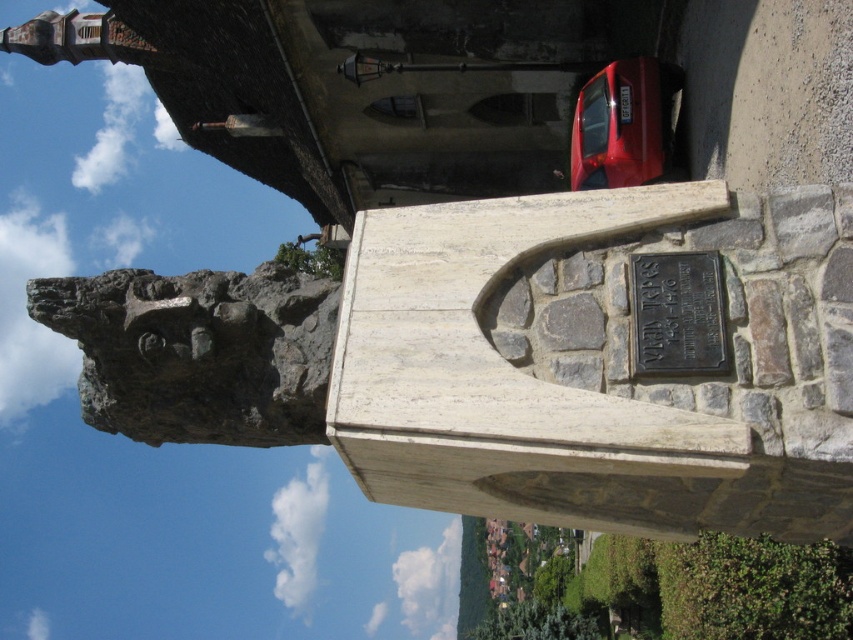
Can you confirm if rough gray rock at upper left is positioned below black metal plaque at center?

Indeed, rough gray rock at upper left is positioned under black metal plaque at center.

Is rough gray rock at upper left bigger than black metal plaque at center?

Yes.

Does point (144, 372) come farther from viewer compared to point (704, 298)?

That is True.

Image resolution: width=853 pixels, height=640 pixels. I want to click on rough gray rock at upper left, so click(x=198, y=353).

Can you confirm if rough gray rock at upper left is wider than shiny red car at right?

Yes, rough gray rock at upper left is wider than shiny red car at right.

Is point (204, 378) farther from viewer compared to point (614, 182)?

No, (204, 378) is closer to viewer.

You are a GUI agent. You are given a task and a screenshot of the screen. Output one action in this format:
    pyautogui.click(x=<x>, y=<y>)
    Task: Click on the rough gray rock at upper left
    
    Given the screenshot: What is the action you would take?
    pyautogui.click(x=198, y=353)

Which is in front, point (622, 120) or point (715, 372)?

Point (715, 372)

Describe the element at coordinates (622, 124) in the screenshot. I see `shiny red car at right` at that location.

This screenshot has width=853, height=640. In order to click on shiny red car at right in this screenshot , I will do `click(622, 124)`.